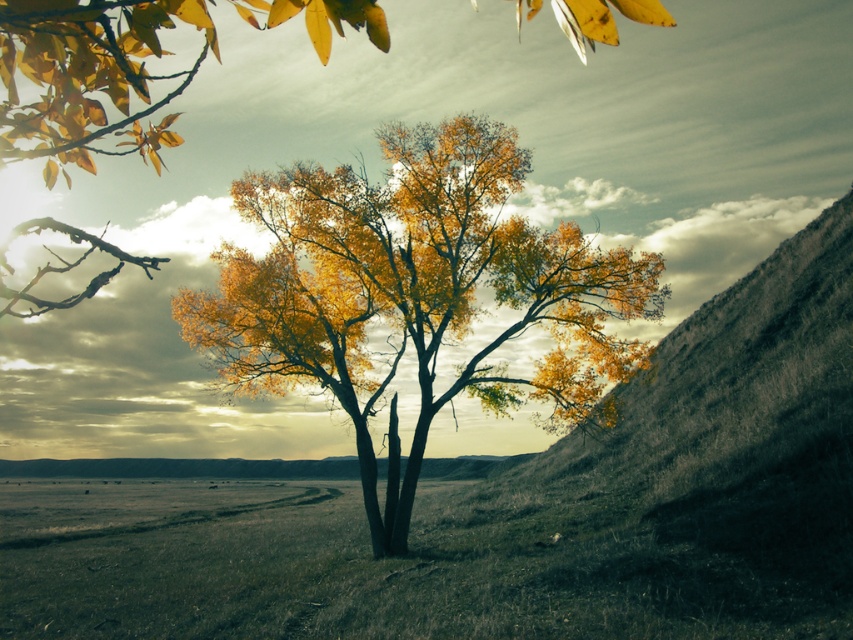
You are standing at the center of the image and want to walk towards the golden textured tree at center. Which direction should you move in?

Since the golden textured tree at center is already at the center of the image, you are already facing it directly. There is no need to move in any direction other than forward to reach it.